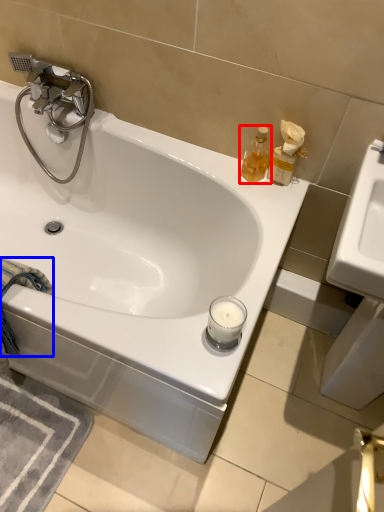
Question: Among these objects, which one is nearest to the camera, soap dispenser (highlighted by a red box) or bath towel (highlighted by a blue box)?

Choices:
 (A) soap dispenser
 (B) bath towel

Answer: (B)